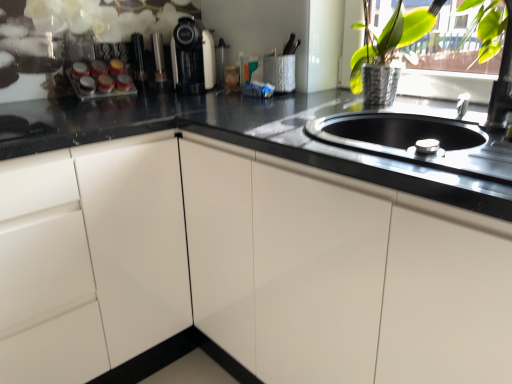
Question: Can you confirm if matte black coffee machine at upper center is bigger than metallic silver vase at upper right?

Choices:
 (A) no
 (B) yes

Answer: (A)

Question: Is matte black coffee machine at upper center taller than metallic silver vase at upper right?

Choices:
 (A) yes
 (B) no

Answer: (B)

Question: From the image's perspective, is matte black coffee machine at upper center on top of metallic silver vase at upper right?

Choices:
 (A) no
 (B) yes

Answer: (B)

Question: Could you tell me if matte black coffee machine at upper center is turned towards metallic silver vase at upper right?

Choices:
 (A) no
 (B) yes

Answer: (A)

Question: Considering the relative positions of matte black coffee machine at upper center and metallic silver vase at upper right in the image provided, is matte black coffee machine at upper center in front of metallic silver vase at upper right?

Choices:
 (A) yes
 (B) no

Answer: (B)

Question: Is matte black coffee machine at upper center looking in the opposite direction of metallic silver vase at upper right?

Choices:
 (A) yes
 (B) no

Answer: (B)

Question: Can you confirm if metallic silver vase at upper right is shorter than matte black coffee machine at upper center?

Choices:
 (A) yes
 (B) no

Answer: (B)

Question: Is metallic silver vase at upper right bigger than matte black coffee machine at upper center?

Choices:
 (A) no
 (B) yes

Answer: (B)

Question: From a real-world perspective, is metallic silver vase at upper right below matte black coffee machine at upper center?

Choices:
 (A) yes
 (B) no

Answer: (B)

Question: Does metallic silver vase at upper right have a smaller size compared to matte black coffee machine at upper center?

Choices:
 (A) no
 (B) yes

Answer: (A)

Question: Is metallic silver vase at upper right at the right side of matte black coffee machine at upper center?

Choices:
 (A) yes
 (B) no

Answer: (A)

Question: Could you tell me if metallic silver vase at upper right is facing matte black coffee machine at upper center?

Choices:
 (A) yes
 (B) no

Answer: (B)

Question: Is metallic silver vase at upper right shorter than white glossy cabinet at left?

Choices:
 (A) no
 (B) yes

Answer: (B)